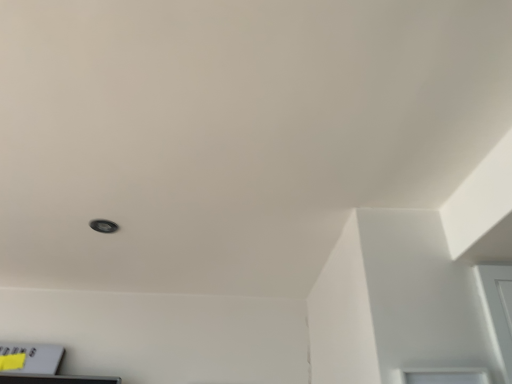
Identify the location of white plastic window at lower right. The image size is (512, 384). (445, 376).

Describe the element at coordinates (445, 376) in the screenshot. I see `white plastic window at lower right` at that location.

The image size is (512, 384). What are the coordinates of `white plastic window at lower right` in the screenshot? It's located at (445, 376).